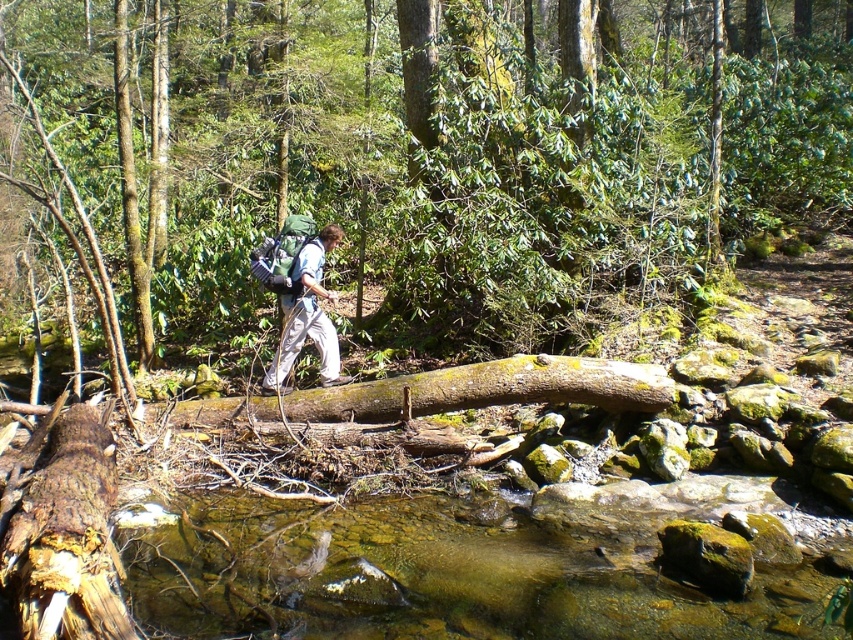
Is smooth brown log at center positioned in front of brown rough tree trunk at lower left?

No, it is not.

Measure the distance between smooth brown log at center and camera.

smooth brown log at center and camera are 6.10 meters apart.

This screenshot has width=853, height=640. I want to click on smooth brown log at center, so click(402, 152).

Consider the image. Does brown rough tree trunk at lower left have a greater width compared to green fabric backpack at center?

Correct, the width of brown rough tree trunk at lower left exceeds that of green fabric backpack at center.

Based on the photo, between brown rough tree trunk at lower left and green fabric backpack at center, which one is positioned higher?

green fabric backpack at center

The height and width of the screenshot is (640, 853). What do you see at coordinates (67, 536) in the screenshot? I see `brown rough tree trunk at lower left` at bounding box center [67, 536].

Image resolution: width=853 pixels, height=640 pixels. I want to click on brown rough tree trunk at lower left, so click(67, 536).

Is point (28, 77) positioned behind point (334, 369)?

Yes, it is.

Which of these two, smooth brown log at center or green fabric backpack at center, stands shorter?

green fabric backpack at center is shorter.

At what (x,y) coordinates should I click in order to perform the action: click on smooth brown log at center. Please return your answer as a coordinate pair (x, y). The width and height of the screenshot is (853, 640). Looking at the image, I should click on (402, 152).